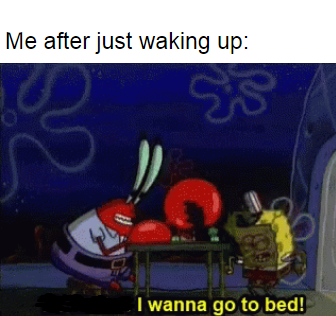
I want to click on door, so click(x=331, y=236).